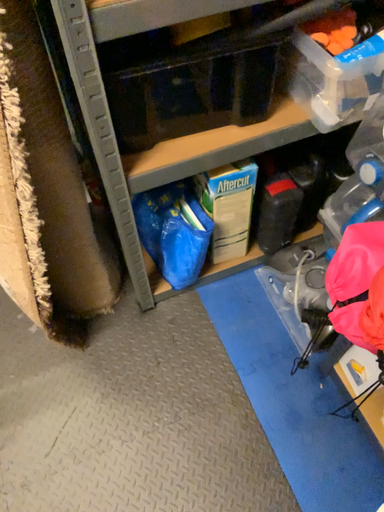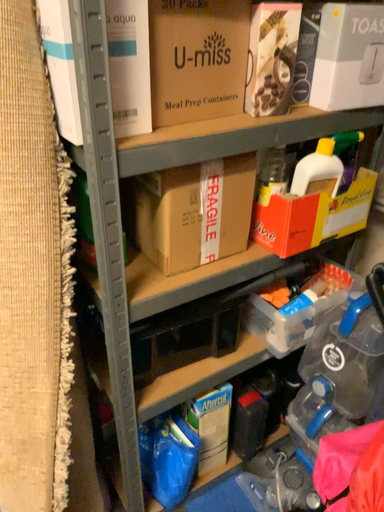
Question: How did the camera likely rotate when shooting the video?

Choices:
 (A) rotated downward
 (B) rotated upward

Answer: (B)